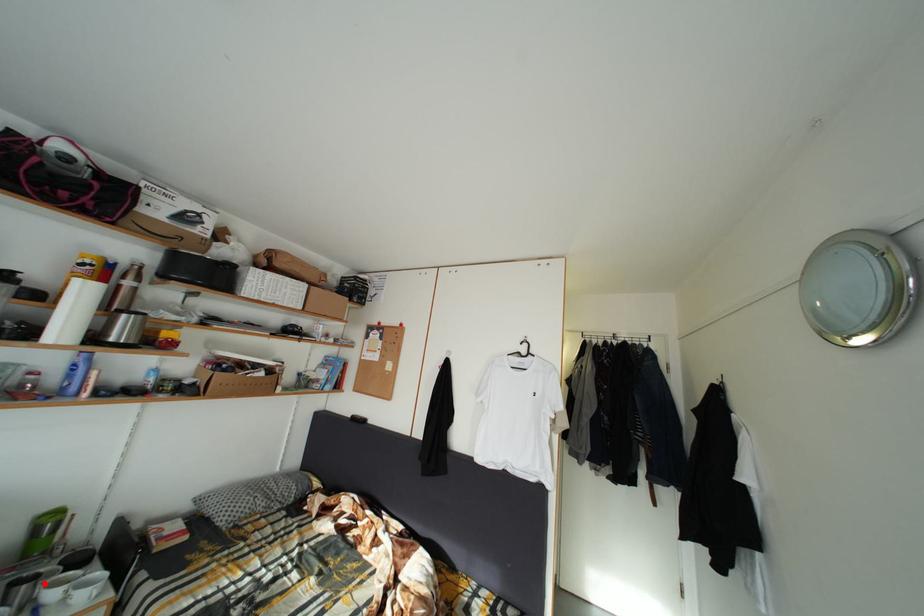
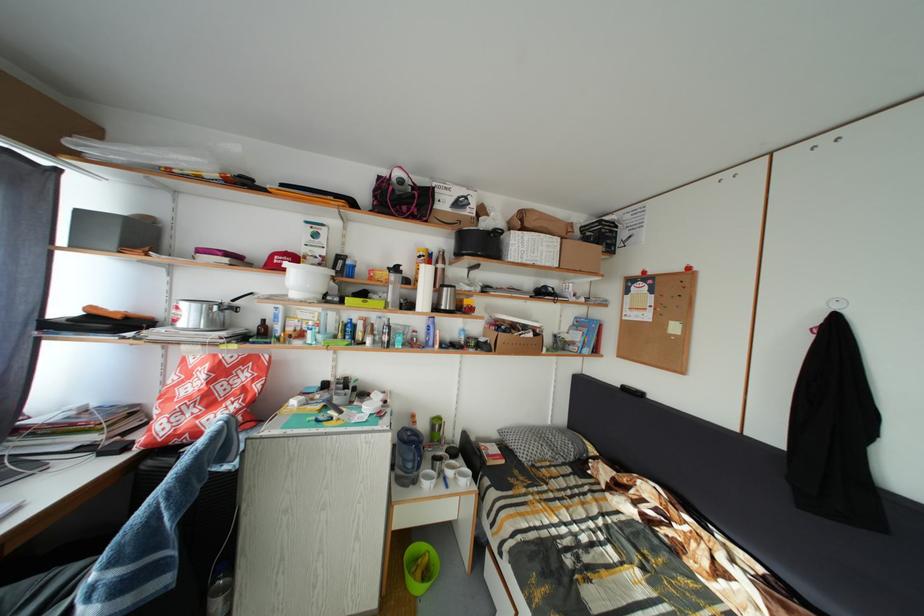
Find the pixel in the second image that matches the highlighted location in the first image.

(450, 464)